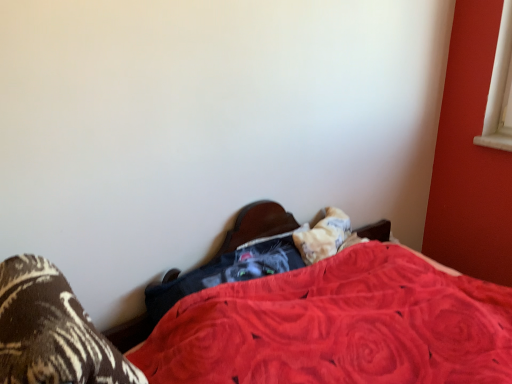
Question: From the image's perspective, is brown textured socks at lower left positioned above or below velvet red blanket at center?

Choices:
 (A) below
 (B) above

Answer: (B)

Question: Considering the positions of brown textured socks at lower left and velvet red blanket at center in the image, is brown textured socks at lower left taller or shorter than velvet red blanket at center?

Choices:
 (A) short
 (B) tall

Answer: (A)

Question: Based on their relative distances, which object is farther from the fluffy white pillow at lower center?

Choices:
 (A) velvet-like black cat at center
 (B) velvet red blanket at center
 (C) brown textured socks at lower left

Answer: (C)

Question: Which object is the farthest from the brown textured socks at lower left?

Choices:
 (A) velvet-like black cat at center
 (B) fluffy white pillow at lower center
 (C) velvet red blanket at center

Answer: (B)